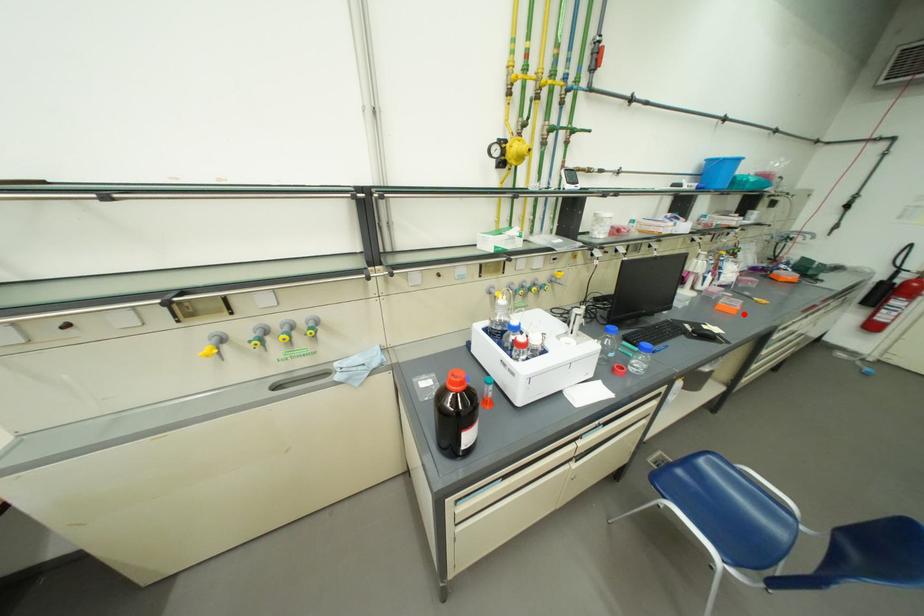
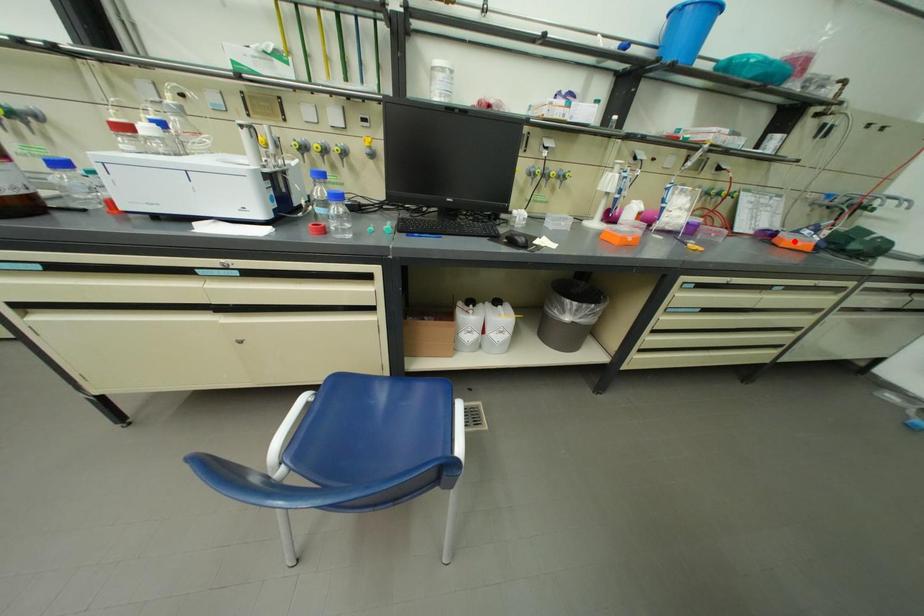
I am providing you with two images of the same scene from different viewpoints. A red point is marked on the first image and another point is marked on the second image. Is the marked point in image1 the same physical position as the marked point in image2?

No